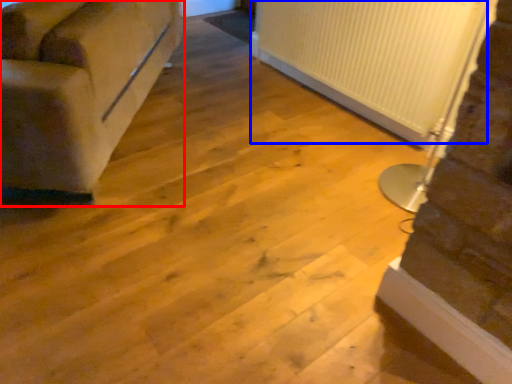
Question: Which point is further to the camera, studio couch (highlighted by a red box) or radiator (highlighted by a blue box)?

Choices:
 (A) studio couch
 (B) radiator

Answer: (B)